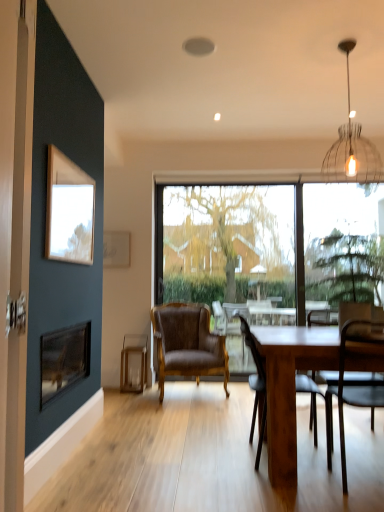
I want to click on vacant area that is in front of brown leather chair at center, the third chair viewed from the front, so click(x=181, y=410).